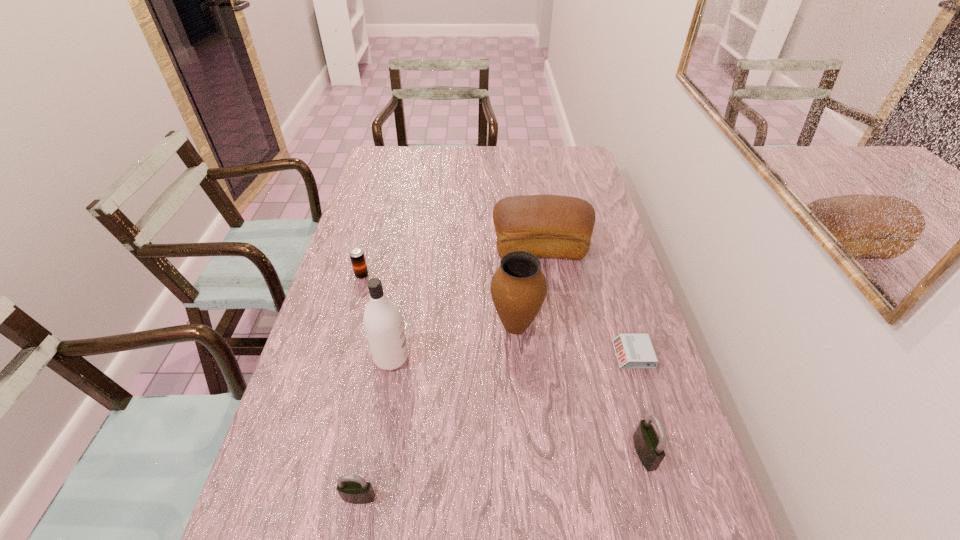
The image size is (960, 540). I want to click on vacant space in between the shortest object and the sixth shortest object, so click(x=574, y=340).

The height and width of the screenshot is (540, 960). What are the coordinates of `free spot between the nearest object and the fourth shortest object` in the screenshot? It's located at (501, 475).

This screenshot has height=540, width=960. Find the location of `free spot between the right padlock and the shortest object`. free spot between the right padlock and the shortest object is located at coordinates (638, 404).

The width and height of the screenshot is (960, 540). What are the coordinates of `free point between the left padlock and the beer can` in the screenshot? It's located at (360, 386).

The height and width of the screenshot is (540, 960). I want to click on blank region between the bread and the alarm clock, so click(587, 301).

The image size is (960, 540). What are the coordinates of `free area in between the third tallest object and the shampoo` in the screenshot? It's located at (466, 302).

Where is `the second closest object to the alarm clock`? the second closest object to the alarm clock is located at coordinates (x=518, y=288).

I want to click on object that stands as the closest to the tallest object, so click(x=518, y=288).

I want to click on free location that satisfies the following two spatial constraints: 1. on the front side of the urn; 2. on the front-facing side of the tallest object, so click(518, 358).

The image size is (960, 540). In order to click on free space in the image that satisfies the following two spatial constraints: 1. on the front side of the farthest object; 2. on the front-facing side of the tallest object in this screenshot , I will do `click(557, 358)`.